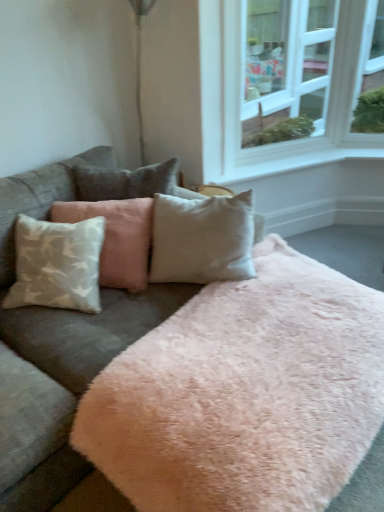
Question: Considering the relative positions of white textured pillow at left and velvet gray couch at center in the image provided, is white textured pillow at left to the left of velvet gray couch at center from the viewer's perspective?

Choices:
 (A) yes
 (B) no

Answer: (A)

Question: From the image's perspective, is white textured pillow at left located beneath velvet gray couch at center?

Choices:
 (A) yes
 (B) no

Answer: (B)

Question: From the image's perspective, is white textured pillow at left located above velvet gray couch at center?

Choices:
 (A) yes
 (B) no

Answer: (A)

Question: Are white textured pillow at left and velvet gray couch at center located far from each other?

Choices:
 (A) yes
 (B) no

Answer: (B)

Question: Can you confirm if white textured pillow at left is smaller than velvet gray couch at center?

Choices:
 (A) yes
 (B) no

Answer: (A)

Question: Is white textured pillow at left bigger than velvet gray couch at center?

Choices:
 (A) yes
 (B) no

Answer: (B)

Question: Is white glass window at upper right shorter than velvet gray couch at center?

Choices:
 (A) no
 (B) yes

Answer: (A)

Question: From the image's perspective, does white glass window at upper right appear higher than velvet gray couch at center?

Choices:
 (A) no
 (B) yes

Answer: (B)

Question: Is velvet gray couch at center located within white glass window at upper right?

Choices:
 (A) no
 (B) yes

Answer: (A)

Question: Considering the relative sizes of white glass window at upper right and velvet gray couch at center in the image provided, is white glass window at upper right smaller than velvet gray couch at center?

Choices:
 (A) no
 (B) yes

Answer: (B)

Question: Is the surface of white glass window at upper right in direct contact with velvet gray couch at center?

Choices:
 (A) no
 (B) yes

Answer: (A)

Question: Would you say white glass window at upper right is outside velvet gray couch at center?

Choices:
 (A) yes
 (B) no

Answer: (A)

Question: Does white glass window at upper right have a smaller size compared to white textured pillow at left?

Choices:
 (A) yes
 (B) no

Answer: (B)